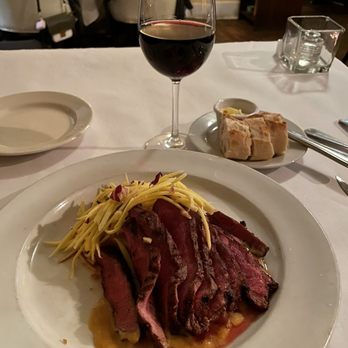
The image size is (348, 348). What are the coordinates of `wine glass stem` in the screenshot? It's located at (176, 105).